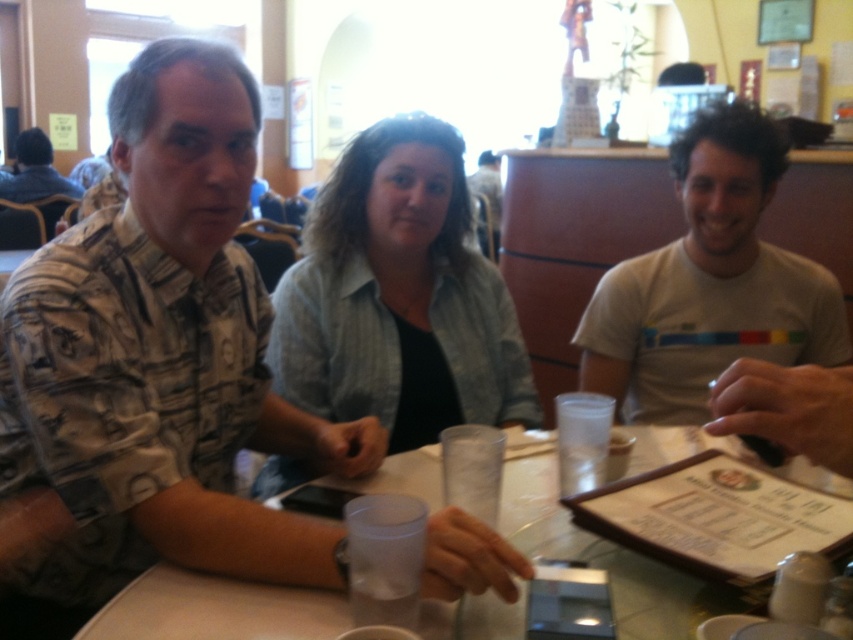
Which is above, clear plastic cup at center or denim jacket at upper left?

denim jacket at upper left is above.

Who is taller, clear plastic cup at center or denim jacket at upper left?

Standing taller between the two is denim jacket at upper left.

Is point (535, 480) farther from camera compared to point (32, 140)?

No.

At what (x,y) coordinates should I click in order to perform the action: click on clear plastic cup at center. Please return your answer as a coordinate pair (x, y). The width and height of the screenshot is (853, 640). Looking at the image, I should click on (602, 557).

Does denim jacket at upper left come behind matte black shirt at center?

No, denim jacket at upper left is closer to the viewer.

Which is more to the left, denim jacket at upper left or matte black shirt at center?

Positioned to the left is denim jacket at upper left.

Is point (22, 134) farther from viewer compared to point (495, 180)?

No, (22, 134) is in front of (495, 180).

Image resolution: width=853 pixels, height=640 pixels. Find the location of `denim jacket at upper left`. denim jacket at upper left is located at coordinates (33, 172).

Can you confirm if gray cotton t-shirt at right is taller than denim jacket at upper left?

Incorrect, gray cotton t-shirt at right's height is not larger of denim jacket at upper left's.

Is point (643, 291) positioned in front of point (36, 184)?

Yes, point (643, 291) is closer to viewer.

What are the coordinates of `gray cotton t-shirt at right` in the screenshot? It's located at (709, 284).